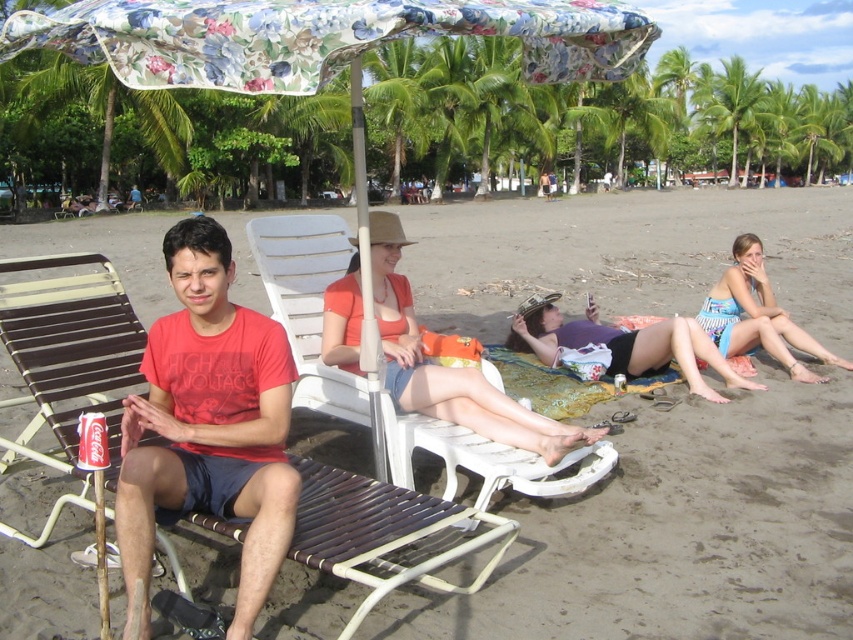
You are a photographer trying to capture a candid shot of the striped fabric bikini bottom at lower right and the green leafy palm tree at upper right. Which object will appear larger in your photo?

The striped fabric bikini bottom at lower right is closer to the viewer than the green leafy palm tree at upper right, so it will appear larger in the photo.

You are a photographer trying to capture a closeup shot of the floral fabric umbrella at upper center and the matte purple bikini at center. Since the camera can only focus on one subject at a time, which object should you choose to ensure it fills the frame more effectively?

The matte purple bikini at center is larger in size compared to the floral fabric umbrella at upper center, so it will fill the frame more effectively. Therefore, you should focus on the matte purple bikini at center to ensure it fills the frame more effectively.

You are a photographer taking a picture of the beach scene. You want to ensure both the floral fabric umbrella at upper center and the matte purple bikini at center are in the frame. Based on their positions, which object should you position closer to the left side of your camera viewfinder?

The floral fabric umbrella at upper center should be positioned closer to the left side of the camera viewfinder because it is located to the left of the matte purple bikini at center in the scene.